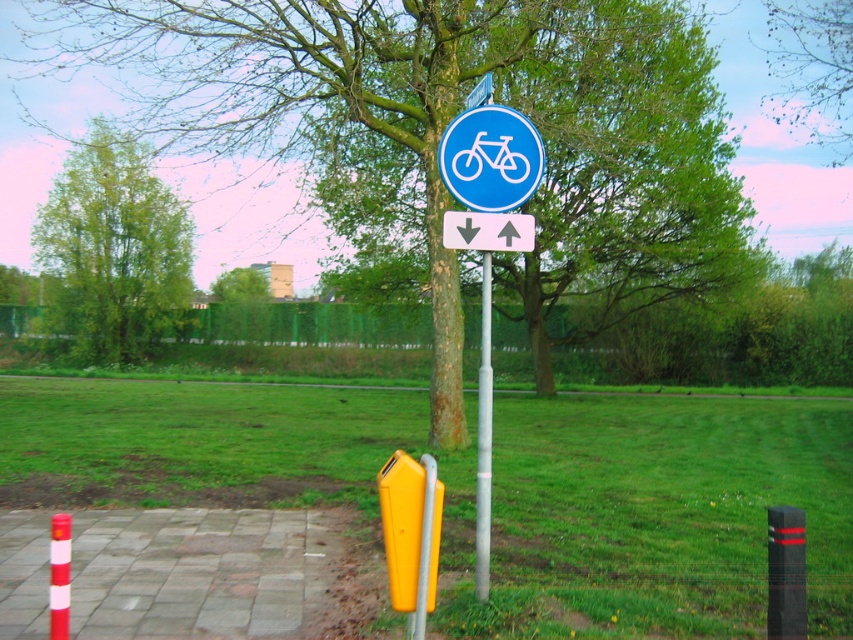
Question: Is green rough bark tree at center wider than yellow plastic parking meter at lower center?

Choices:
 (A) yes
 (B) no

Answer: (A)

Question: Which point appears farthest from the camera in this image?

Choices:
 (A) pyautogui.click(x=519, y=164)
 (B) pyautogui.click(x=515, y=195)

Answer: (A)

Question: Is yellow plastic parking meter at lower center wider than green leafy tree at center?

Choices:
 (A) no
 (B) yes

Answer: (A)

Question: Which point appears closest to the camera in this image?

Choices:
 (A) (494, 160)
 (B) (167, 301)
 (C) (486, 509)
 (D) (485, 176)

Answer: (C)

Question: Does green leafy tree at upper center have a greater width compared to green leafy tree at center?

Choices:
 (A) yes
 (B) no

Answer: (A)

Question: Based on their relative distances, which object is farther from the blue plastic sign at upper center?

Choices:
 (A) metallic pole at center
 (B) green leafy tree at upper left
 (C) yellow plastic parking meter at lower center

Answer: (B)